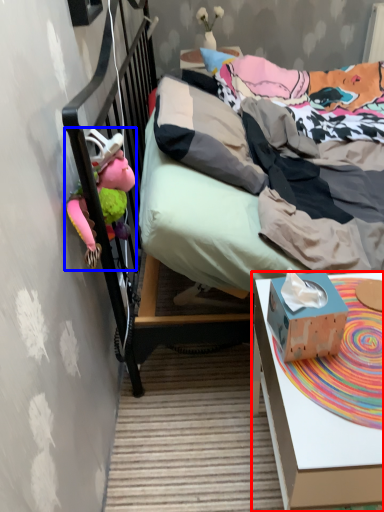
Question: Among these objects, which one is nearest to the camera, desk (highlighted by a red box) or toy (highlighted by a blue box)?

Choices:
 (A) desk
 (B) toy

Answer: (A)